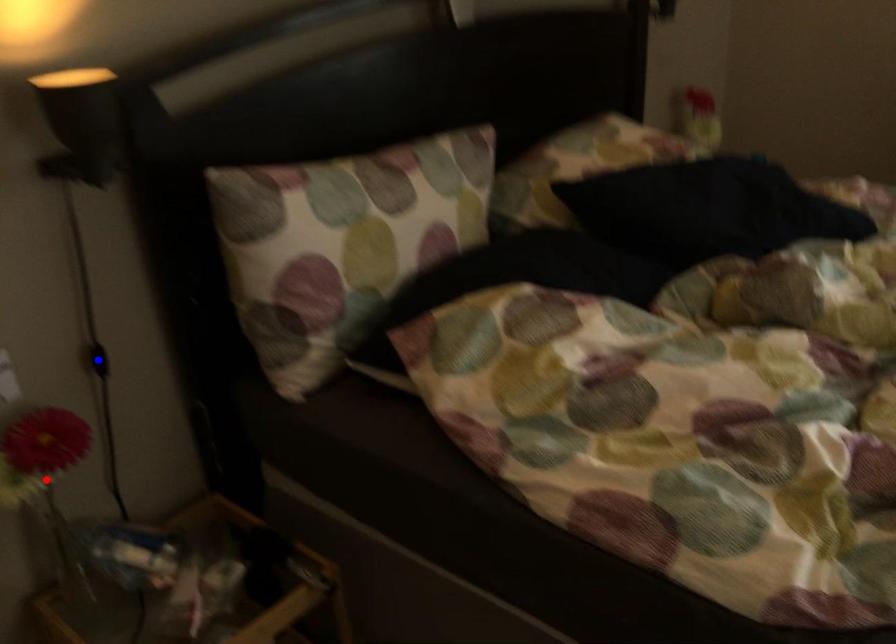
Question: In the image, two points are highlighted. Which point is nearer to the camera? Reply with the corresponding letter.

Choices:
 (A) blue point
 (B) red point

Answer: (B)